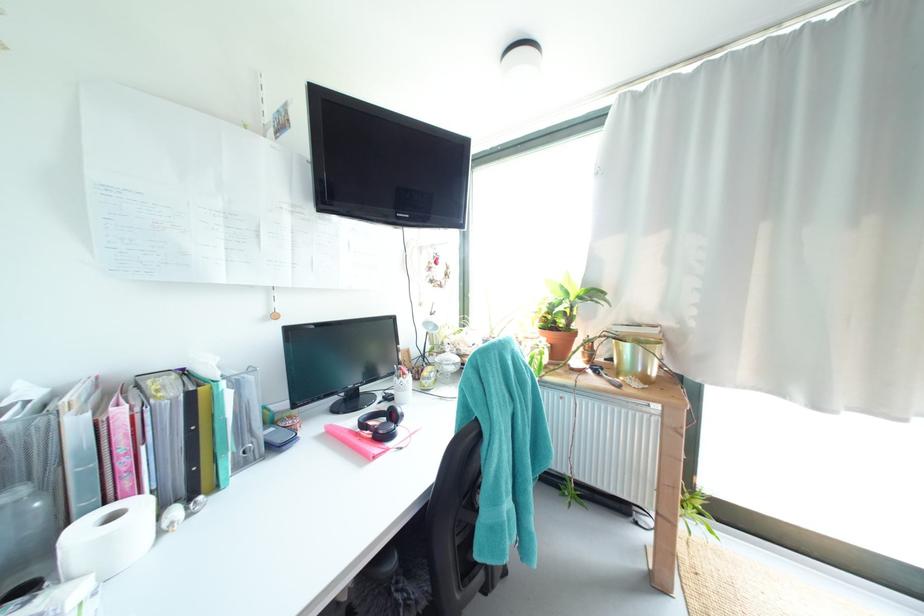
The location [240,416] corresponds to which object?

It corresponds to the teal binder in the image.